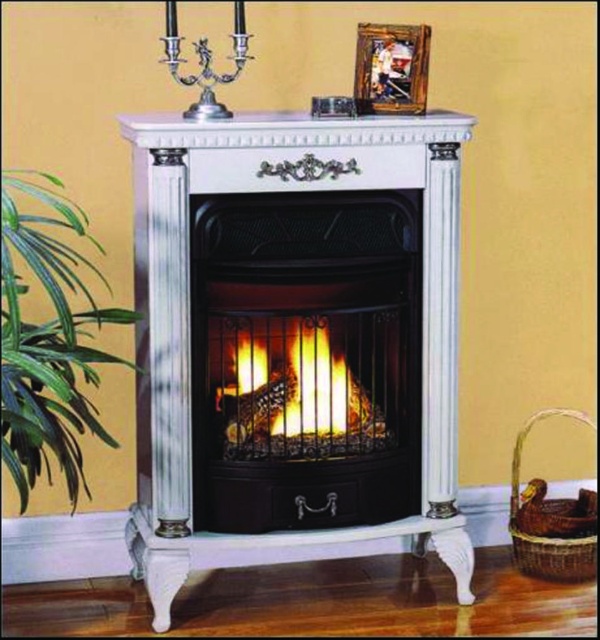
Question: Which of these objects is positioned farthest from the wooden photo frame at upper center?

Choices:
 (A) silver metallic candle holder at upper center
 (B) green leafy plant at left
 (C) orange glowing wood at center

Answer: (B)

Question: Does white glossy fireplace at center lie behind orange glowing wood at center?

Choices:
 (A) no
 (B) yes

Answer: (A)

Question: Is orange glowing wood at center in front of wooden photo frame at upper center?

Choices:
 (A) yes
 (B) no

Answer: (B)

Question: Can you confirm if green leafy plant at left is thinner than orange glowing wood at center?

Choices:
 (A) no
 (B) yes

Answer: (B)

Question: Among these objects, which one is farthest from the camera?

Choices:
 (A) wooden photo frame at upper center
 (B) orange glowing wood at center

Answer: (B)

Question: Which of the following is the closest to the observer?

Choices:
 (A) green leafy plant at left
 (B) white glossy fireplace at center
 (C) orange glowing wood at center

Answer: (A)